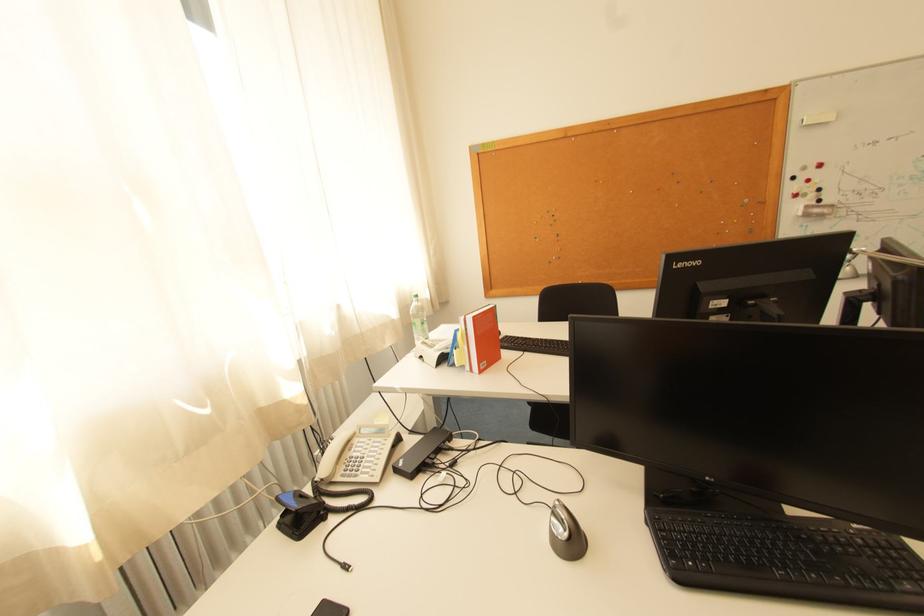
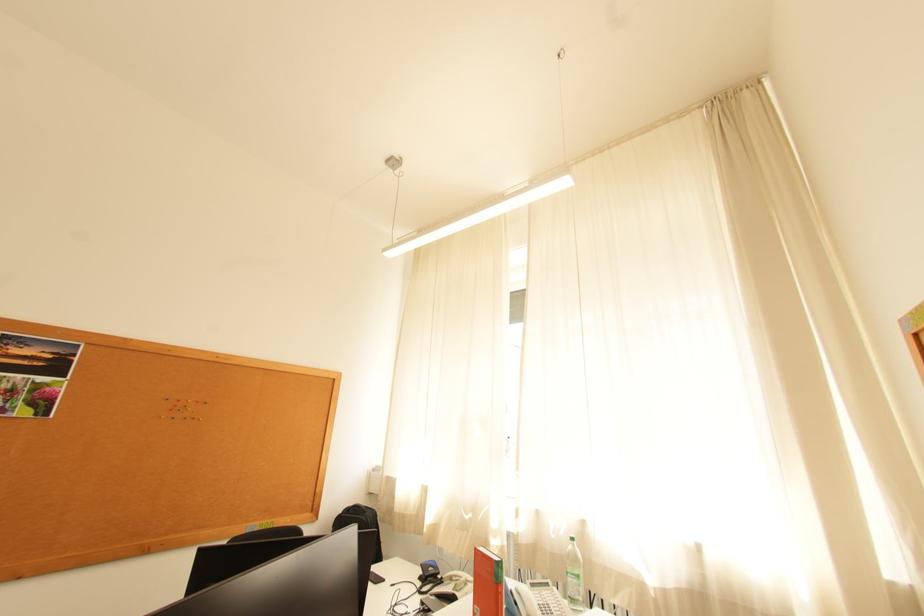
Locate, in the second image, the point that corresponds to point 345,329 in the first image.

(569, 536)